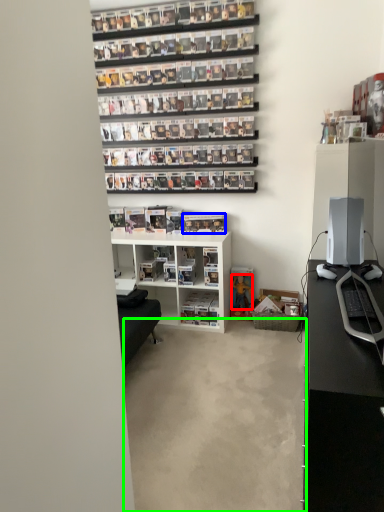
Question: Based on their relative distances, which object is nearer to toy (highlighted by a red box)? Choose from book (highlighted by a blue box) and concrete (highlighted by a green box).

Choices:
 (A) book
 (B) concrete

Answer: (A)